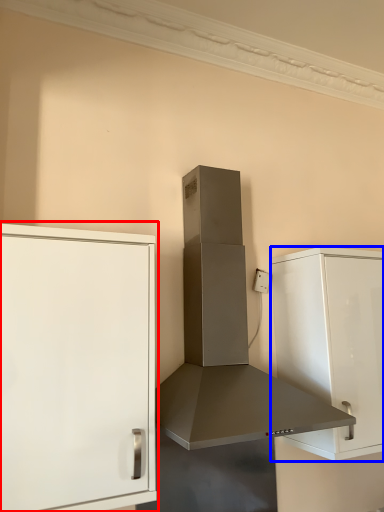
Question: Among these objects, which one is farthest to the camera, cabinetry (highlighted by a red box) or cabinetry (highlighted by a blue box)?

Choices:
 (A) cabinetry
 (B) cabinetry

Answer: (B)